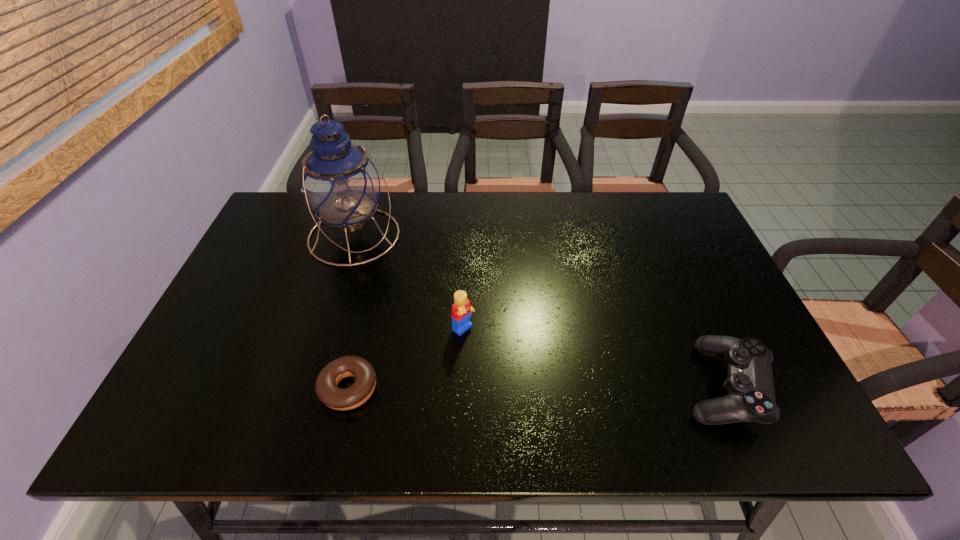
This screenshot has width=960, height=540. Identify the location of free spot between the third shortest object and the second shortest object. (593, 358).

Locate an element on the screen. This screenshot has height=540, width=960. free space that is in between the third tallest object and the shortest object is located at coordinates (536, 387).

You are a GUI agent. You are given a task and a screenshot of the screen. Output one action in this format:
    pyautogui.click(x=<x>, y=<y>)
    Task: Click on the free space between the third tallest object and the second farthest object
    The width and height of the screenshot is (960, 540).
    Given the screenshot: What is the action you would take?
    pyautogui.click(x=593, y=358)

The image size is (960, 540). In order to click on blank region between the control and the Lego in this screenshot , I will do `click(593, 358)`.

What are the coordinates of `vacant point located between the shortest object and the second farthest object` in the screenshot? It's located at (406, 359).

Find the location of a particular element. blank region between the rightmost object and the third shortest object is located at coordinates (593, 358).

What are the coordinates of `vacant point located between the farthest object and the control` in the screenshot? It's located at (539, 311).

Locate an element on the screen. This screenshot has width=960, height=540. empty space that is in between the second farthest object and the control is located at coordinates (593, 358).

Where is `vacant area that lies between the control and the third object from left to right`? vacant area that lies between the control and the third object from left to right is located at coordinates (593, 358).

You are a GUI agent. You are given a task and a screenshot of the screen. Output one action in this format:
    pyautogui.click(x=<x>, y=<y>)
    Task: Click on the object that ranks as the third closest to the Lego
    Image resolution: width=960 pixels, height=540 pixels.
    Given the screenshot: What is the action you would take?
    pyautogui.click(x=750, y=386)